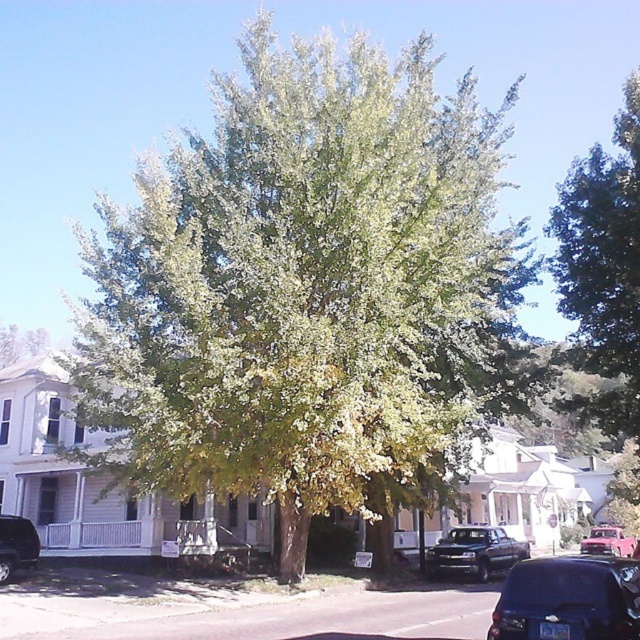
Is green leafy tree at center bigger than metallic gray truck at center?

Yes, green leafy tree at center is bigger than metallic gray truck at center.

Measure the distance between point (x=342, y=353) and camera.

A distance of 41.97 feet exists between point (x=342, y=353) and camera.

Is point (97, 280) less distant than point (481, 572)?

Yes, point (97, 280) is closer to viewer.

The width and height of the screenshot is (640, 640). Find the location of `green leafy tree at center`. green leafy tree at center is located at coordinates (308, 292).

Is shiny black car at lower right thinner than metallic gray truck at center?

In fact, shiny black car at lower right might be wider than metallic gray truck at center.

Who is more forward, (598, 598) or (484, 570)?

Point (598, 598) is more forward.

This screenshot has width=640, height=640. Find the location of `shiny black car at lower right`. shiny black car at lower right is located at coordinates (568, 600).

Does green leafy tree at center appear on the left side of green leafy tree at upper right?

Indeed, green leafy tree at center is positioned on the left side of green leafy tree at upper right.

Which is below, green leafy tree at center or green leafy tree at upper right?

green leafy tree at center

Is point (406, 282) positioned before point (632, 358)?

Yes, point (406, 282) is in front of point (632, 358).

I want to click on green leafy tree at center, so click(308, 292).